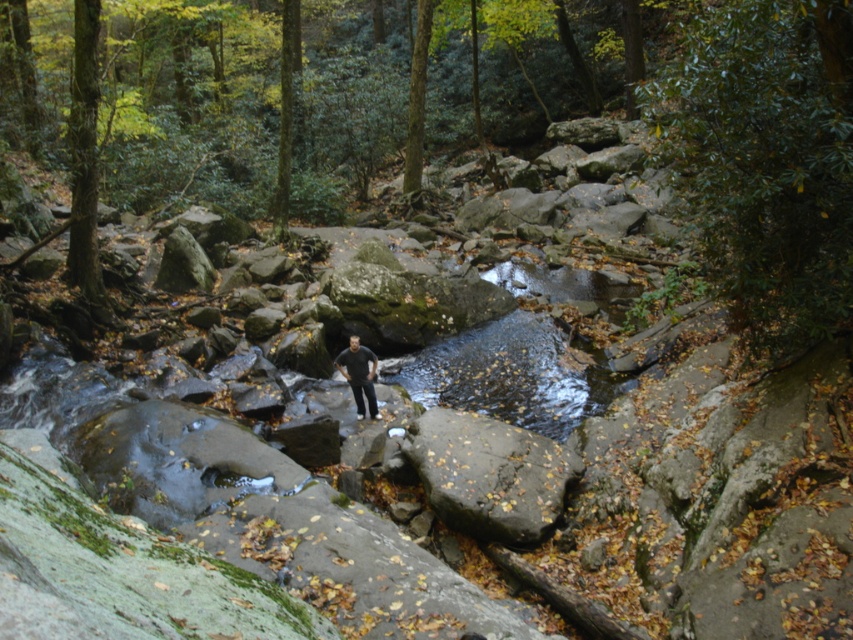
Question: Can you confirm if green mossy rock at center is positioned to the left of dark gray textured rock at center?

Choices:
 (A) yes
 (B) no

Answer: (A)

Question: Can you confirm if green mossy rock at center is positioned above clear water at center?

Choices:
 (A) yes
 (B) no

Answer: (A)

Question: Is green mossy rock at center in front of clear water at center?

Choices:
 (A) no
 (B) yes

Answer: (B)

Question: Estimate the real-world distances between objects in this image. Which object is closer to the dark gray textured rock at center?

Choices:
 (A) green mossy rock at center
 (B) dark gray pants at center
 (C) clear water at center

Answer: (B)

Question: Which point is closer to the camera taking this photo?

Choices:
 (A) (149, 19)
 (B) (537, 392)
 (C) (486, 474)
 (D) (372, 410)

Answer: (C)

Question: Which of the following is the closest to the observer?

Choices:
 (A) dark gray pants at center
 (B) dark gray textured rock at center

Answer: (B)